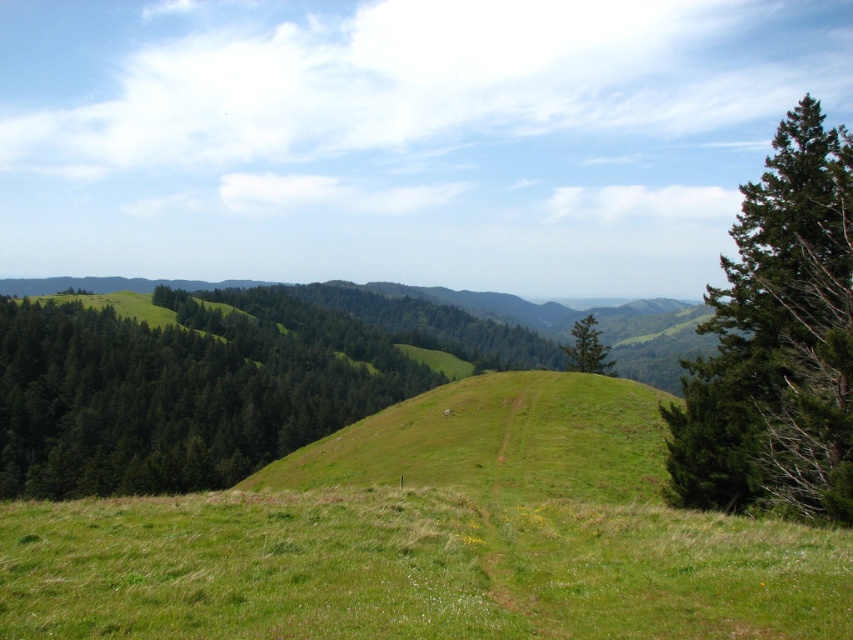
Is green matte tree at left taller than green needle-like at right?

Yes, green matte tree at left is taller than green needle-like at right.

Does point (7, 321) come in front of point (762, 390)?

No.

Find the location of `green matte tree at left`. green matte tree at left is located at coordinates coord(180,392).

Can you confirm if green needle-like at right is bigger than green textured tree at center?

No.

Is green needle-like at right closer to the viewer compared to green textured tree at center?

Yes, it is in front of green textured tree at center.

Locate an element on the screen. The image size is (853, 640). green needle-like at right is located at coordinates (776, 340).

Measure the distance from green matte tree at left to green textured tree at center.

A distance of 107.54 meters exists between green matte tree at left and green textured tree at center.

Is green matte tree at left wider than green textured tree at center?

Yes.

Between point (215, 352) and point (572, 356), which one is positioned in front?

Point (572, 356) is in front.

The width and height of the screenshot is (853, 640). I want to click on green matte tree at left, so click(x=180, y=392).